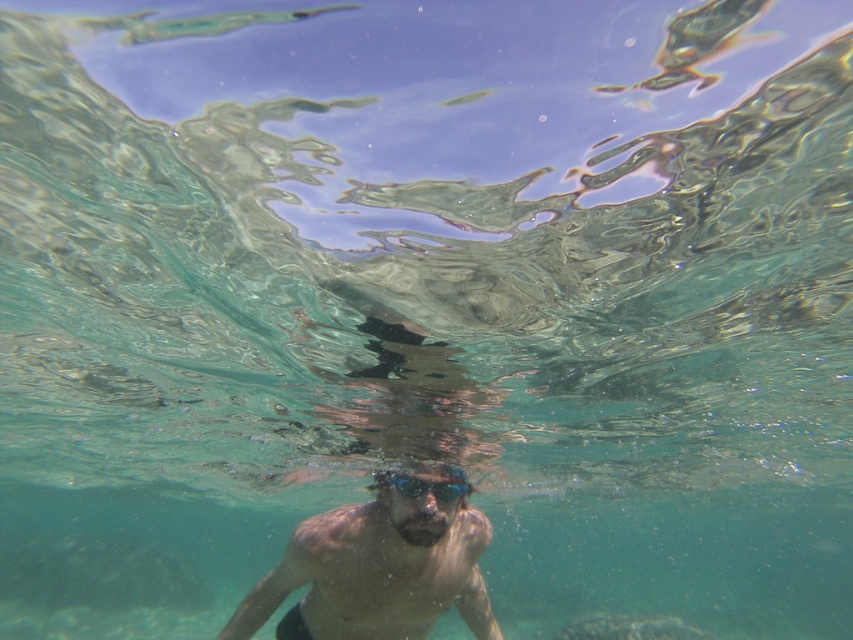
Does smooth skin man at center have a greater height compared to transparent plastic goggles at center?

Indeed, smooth skin man at center has a greater height compared to transparent plastic goggles at center.

In the scene shown: Can you confirm if smooth skin man at center is positioned above transparent plastic goggles at center?

Actually, smooth skin man at center is below transparent plastic goggles at center.

This screenshot has height=640, width=853. I want to click on smooth skin man at center, so click(379, 566).

Identify the location of smooth skin man at center. (379, 566).